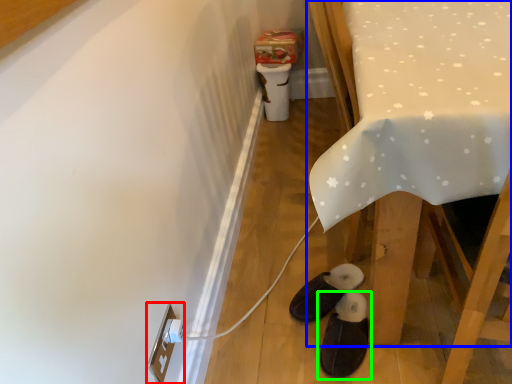
Question: Which object is the farthest from electric outlet (highlighted by a red box)? Choose among these: furniture (highlighted by a blue box) or footwear (highlighted by a green box).

Choices:
 (A) furniture
 (B) footwear

Answer: (A)